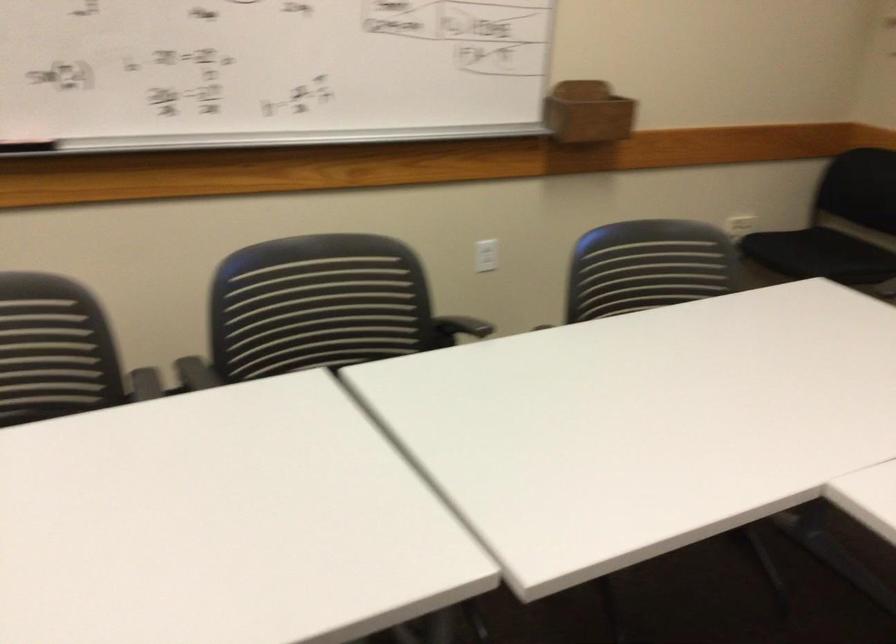
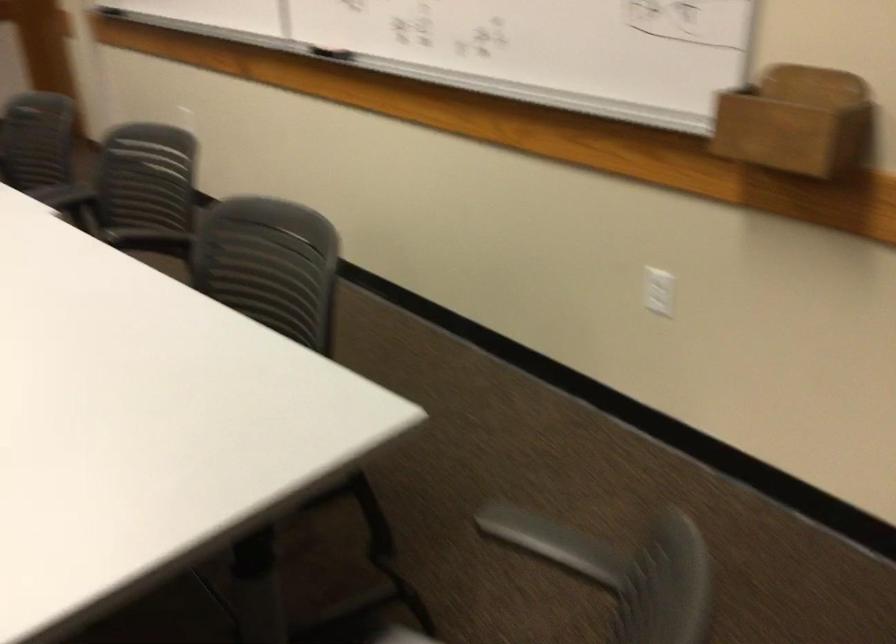
The point at (614, 106) is marked in the first image. Where is the corresponding point in the second image?

(797, 122)